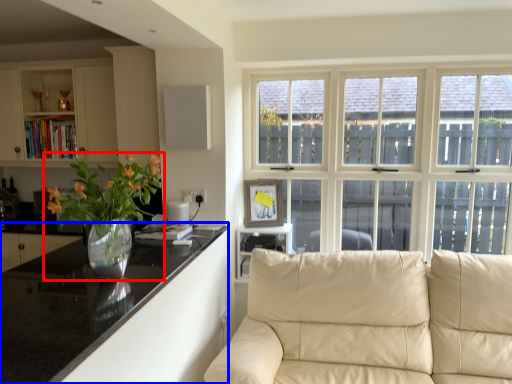
Question: Which object appears closest to the camera in this image, houseplant (highlighted by a red box) or countertop (highlighted by a blue box)?

Choices:
 (A) houseplant
 (B) countertop

Answer: (B)